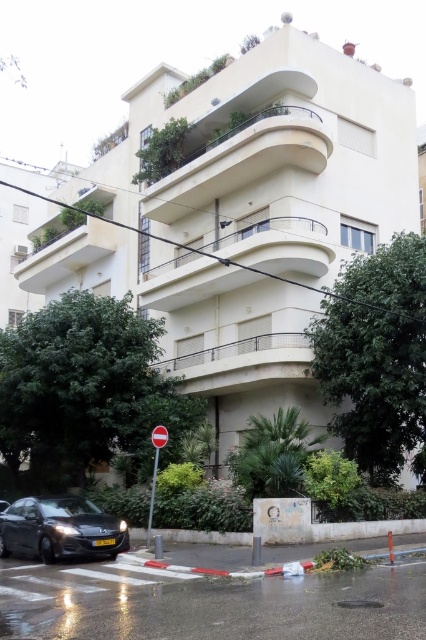
Question: Which object is farther from the camera taking this photo?

Choices:
 (A) shiny black car at lower left
 (B) red plastic sign at center

Answer: (B)

Question: Is shiny black car at lower left thinner than red plastic stop sign at center?

Choices:
 (A) yes
 (B) no

Answer: (B)

Question: Which of these objects is positioned closest to the red plastic sign at center?

Choices:
 (A) shiny black car at lower left
 (B) red plastic stop sign at center

Answer: (B)

Question: Which is farther from the red plastic stop sign at center?

Choices:
 (A) red plastic sign at center
 (B) shiny black car at lower left

Answer: (B)

Question: From the image, what is the correct spatial relationship of red plastic sign at center in relation to red plastic stop sign at center?

Choices:
 (A) above
 (B) below

Answer: (B)

Question: Can you confirm if shiny black car at lower left is smaller than red plastic stop sign at center?

Choices:
 (A) no
 (B) yes

Answer: (A)